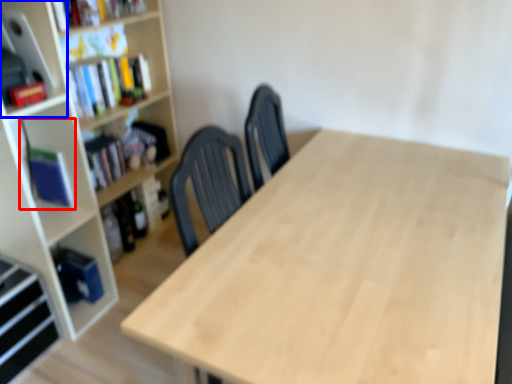
Question: Which point is closer to the camera, book (highlighted by a red box) or cabinet (highlighted by a blue box)?

Choices:
 (A) book
 (B) cabinet

Answer: (B)